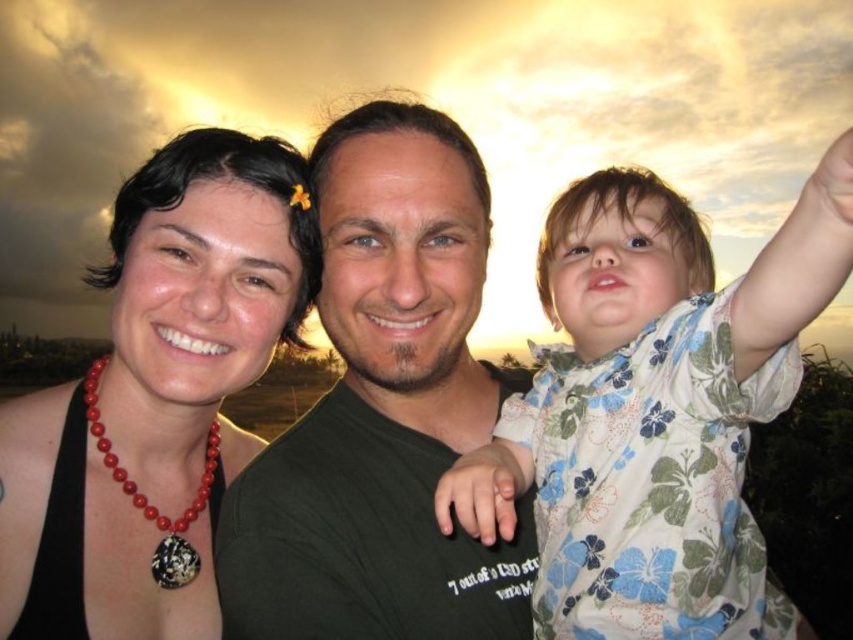
Can you confirm if dark green t-shirt at center is taller than matte coral necklace at upper left?

Indeed, dark green t-shirt at center has a greater height compared to matte coral necklace at upper left.

Is point (263, 518) positioned behind point (126, 506)?

That is False.

Locate an element on the screen. Image resolution: width=853 pixels, height=640 pixels. dark green t-shirt at center is located at coordinates [383, 410].

Is matte coral necklace at upper left taller than red beaded necklace at left?

Yes, matte coral necklace at upper left is taller than red beaded necklace at left.

Which is in front, point (155, 404) or point (175, 582)?

Positioned in front is point (175, 582).

Who is more forward, (229, 333) or (103, 464)?

Point (103, 464)

Find the location of a particular element. matte coral necklace at upper left is located at coordinates (x=155, y=392).

Between point (796, 358) and point (173, 577), which one is positioned behind?

Point (173, 577)

Is floral fabric shirt at right smaller than red beaded necklace at left?

No, floral fabric shirt at right is not smaller than red beaded necklace at left.

Where is `floral fabric shirt at right`? The height and width of the screenshot is (640, 853). floral fabric shirt at right is located at coordinates (653, 412).

Locate an element on the screen. floral fabric shirt at right is located at coordinates (653, 412).